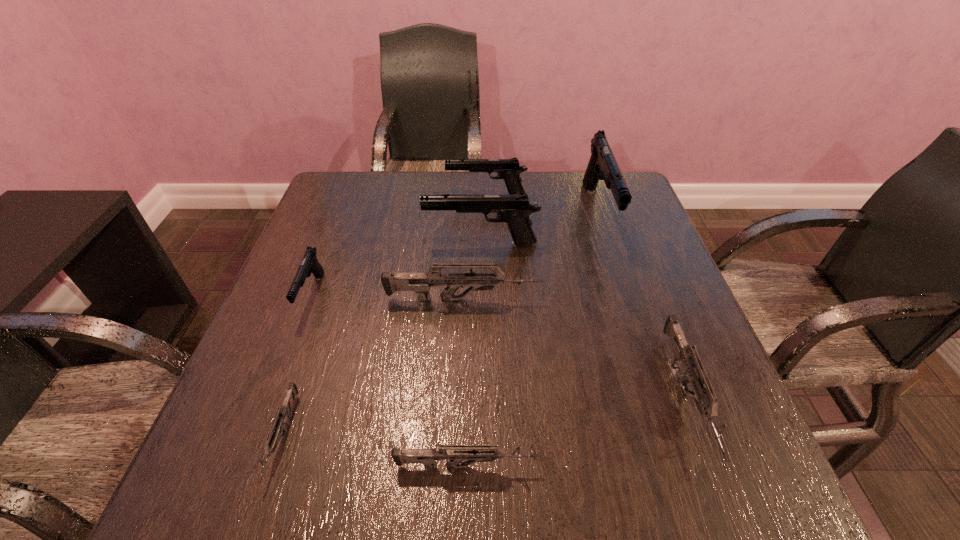
What are the coordinates of `the second object from right to left` in the screenshot? It's located at pos(602,165).

You are a GUI agent. You are given a task and a screenshot of the screen. Output one action in this format:
    pyautogui.click(x=<x>, y=<y>)
    Task: Click on the biggest black gun
    
    Given the screenshot: What is the action you would take?
    pyautogui.click(x=602, y=165)

You are a GUI agent. You are given a task and a screenshot of the screen. Output one action in this format:
    pyautogui.click(x=<x>, y=<y>)
    Task: Click on the second tallest gun
    
    Given the screenshot: What is the action you would take?
    pyautogui.click(x=514, y=210)

Find the location of a particular element. the seventh shortest object is located at coordinates (514, 210).

Identify the location of the third biggest black gun. (509, 170).

You are a GUI agent. You are given a task and a screenshot of the screen. Output one action in this format:
    pyautogui.click(x=<x>, y=<y>)
    Task: Click on the farthest grey gun
    This screenshot has height=540, width=960.
    Given the screenshot: What is the action you would take?
    pyautogui.click(x=420, y=283)

Identify the location of the nearest black gun. This screenshot has width=960, height=540. (309, 264).

This screenshot has width=960, height=540. Identify the location of the smallest black gun. (309, 264).

Find the location of `the rightmost grey gun`. the rightmost grey gun is located at coordinates (706, 402).

Where is `the rightmost object`? This screenshot has width=960, height=540. the rightmost object is located at coordinates (706, 402).